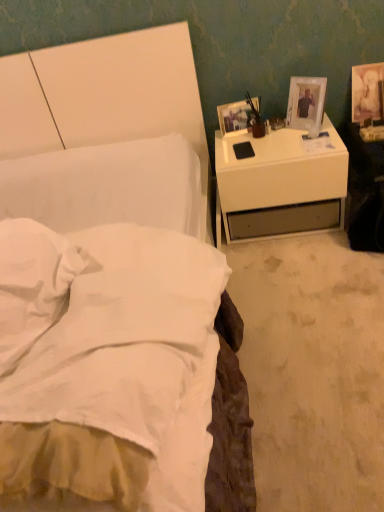
In order to click on white plastic picture frame at upper right, acting as the 2th picture frame starting from the right in this screenshot , I will do `click(306, 104)`.

What do you see at coordinates (235, 118) in the screenshot?
I see `matte white picture frame at upper right, the 1th picture frame positioned from the left` at bounding box center [235, 118].

What is the approximate width of white glossy nightstand at right?

white glossy nightstand at right is 54.21 centimeters wide.

This screenshot has height=512, width=384. What are the coordinates of `white soft bed at left` in the screenshot? It's located at (109, 348).

Locate an element on the screen. The image size is (384, 512). white plastic picture frame at upper right, the second picture frame viewed from the left is located at coordinates (306, 104).

From a real-world perspective, who is located higher, matte gold picture frame at upper right, arranged as the third picture frame when viewed from the left, or matte white picture frame at upper right, the third picture frame from the right?

matte white picture frame at upper right, the third picture frame from the right.

From the image's perspective, is matte gold picture frame at upper right, arranged as the third picture frame when viewed from the left, located above or below matte white picture frame at upper right, the third picture frame from the right?

Based on their image positions, matte gold picture frame at upper right, arranged as the third picture frame when viewed from the left, is located above matte white picture frame at upper right, the third picture frame from the right.

Is matte gold picture frame at upper right, the first picture frame when ordered from right to left, oriented towards matte white picture frame at upper right, the 1th picture frame positioned from the left?

No.

Is matte white picture frame at upper right, the third picture frame from the right, behind white plastic picture frame at upper right, acting as the 2th picture frame starting from the right?

Yes, matte white picture frame at upper right, the third picture frame from the right, is further from the viewer.

Is matte white picture frame at upper right, the 1th picture frame positioned from the left, not inside white plastic picture frame at upper right, the second picture frame viewed from the left?

matte white picture frame at upper right, the 1th picture frame positioned from the left, lies outside white plastic picture frame at upper right, the second picture frame viewed from the left,'s area.

Starting from the white plastic picture frame at upper right, acting as the 2th picture frame starting from the right, which picture frame is the 2nd one behind? Please provide its 2D coordinates.

[(235, 118)]

Is matte white picture frame at upper right, the third picture frame from the right, directly adjacent to white plastic picture frame at upper right, acting as the 2th picture frame starting from the right?

There is a gap between matte white picture frame at upper right, the third picture frame from the right, and white plastic picture frame at upper right, acting as the 2th picture frame starting from the right.

From a real-world perspective, is white glossy nightstand at right above or below white soft bed at left?

white glossy nightstand at right is situated lower than white soft bed at left in the real world.

Which object is closer to the camera, white glossy nightstand at right or white soft bed at left?

Positioned in front is white soft bed at left.

Does white glossy nightstand at right have a lesser width compared to white soft bed at left?

Yes, white glossy nightstand at right is thinner than white soft bed at left.

Between white glossy nightstand at right and white soft bed at left, which one has more height?

white soft bed at left.

Is white soft pillow at lower left completely or partially inside white soft bed at left?

Indeed, white soft pillow at lower left is located within white soft bed at left.

Considering the positions of point (174, 488) and point (55, 246), is point (174, 488) closer or farther from the camera than point (55, 246)?

Point (174, 488) is positioned closer to the camera compared to point (55, 246).

Considering the relative sizes of white soft bed at left and white soft pillow at lower left in the image provided, is white soft bed at left thinner than white soft pillow at lower left?

No.

From a real-world perspective, which object rests below the other?

From a 3D spatial view, white soft bed at left is below.

Does white soft bed at left have a smaller size compared to white glossy nightstand at right?

No, white soft bed at left is not smaller than white glossy nightstand at right.

Is white soft bed at left shorter than white glossy nightstand at right?

Incorrect, the height of white soft bed at left does not fall short of that of white glossy nightstand at right.

Would you consider matte gold picture frame at upper right, the first picture frame when ordered from right to left, to be distant from white glossy nightstand at right?

No, matte gold picture frame at upper right, the first picture frame when ordered from right to left, is not far away from white glossy nightstand at right.

Which of these two, matte gold picture frame at upper right, arranged as the third picture frame when viewed from the left, or white glossy nightstand at right, is thinner?

With smaller width is matte gold picture frame at upper right, arranged as the third picture frame when viewed from the left.

From the image's perspective, is matte gold picture frame at upper right, arranged as the third picture frame when viewed from the left, above or below white glossy nightstand at right?

From the image's perspective, matte gold picture frame at upper right, arranged as the third picture frame when viewed from the left, appears above white glossy nightstand at right.

Can you confirm if matte gold picture frame at upper right, the first picture frame when ordered from right to left, is smaller than white glossy nightstand at right?

Yes.

Based on the photo, is white soft pillow at lower left not close to matte gold picture frame at upper right, arranged as the third picture frame when viewed from the left?

Indeed, white soft pillow at lower left is not near matte gold picture frame at upper right, arranged as the third picture frame when viewed from the left.

Identify the location of pillow in front of the matte gold picture frame at upper right, the first picture frame when ordered from right to left. This screenshot has height=512, width=384. (33, 283).

Could you measure the distance between white soft pillow at lower left and matte gold picture frame at upper right, arranged as the third picture frame when viewed from the left?

white soft pillow at lower left is 1.86 meters away from matte gold picture frame at upper right, arranged as the third picture frame when viewed from the left.

Can you confirm if white soft pillow at lower left is positioned to the right of matte gold picture frame at upper right, arranged as the third picture frame when viewed from the left?

Incorrect, white soft pillow at lower left is not on the right side of matte gold picture frame at upper right, arranged as the third picture frame when viewed from the left.

Image resolution: width=384 pixels, height=512 pixels. There is a matte gold picture frame at upper right, the first picture frame when ordered from right to left. Identify the location of the 1st picture frame above it (from a real-world perspective). (235, 118).

Starting from the white plastic picture frame at upper right, the second picture frame viewed from the left, which picture frame is the 2nd one behind? Please provide its 2D coordinates.

[(235, 118)]

Considering their positions, is matte white picture frame at upper right, the 1th picture frame positioned from the left, positioned further to white plastic picture frame at upper right, the second picture frame viewed from the left, than white soft pillow at lower left?

white soft pillow at lower left.

Which object lies nearer to the anchor point white soft pillow at lower left, matte white picture frame at upper right, the 1th picture frame positioned from the left, or white soft bed at left?

Among the two, white soft bed at left is located nearer to white soft pillow at lower left.

Which object lies nearer to the anchor point matte white picture frame at upper right, the third picture frame from the right, white soft bed at left or white soft pillow at lower left?

The object closer to matte white picture frame at upper right, the third picture frame from the right, is white soft bed at left.

Which object lies nearer to the anchor point white soft bed at left, matte gold picture frame at upper right, arranged as the third picture frame when viewed from the left, or white soft pillow at lower left?

white soft pillow at lower left.

Looking at the image, which one is located further to white glossy nightstand at right, white plastic picture frame at upper right, the second picture frame viewed from the left, or white soft pillow at lower left?

white soft pillow at lower left.

When comparing their distances from white plastic picture frame at upper right, the second picture frame viewed from the left, does matte gold picture frame at upper right, the first picture frame when ordered from right to left, or white soft pillow at lower left seem closer?

matte gold picture frame at upper right, the first picture frame when ordered from right to left, lies closer to white plastic picture frame at upper right, the second picture frame viewed from the left, than the other object.

Looking at the image, which one is located closer to white plastic picture frame at upper right, the second picture frame viewed from the left, white soft bed at left or white soft pillow at lower left?

Based on the image, white soft bed at left appears to be nearer to white plastic picture frame at upper right, the second picture frame viewed from the left.

Estimate the real-world distances between objects in this image. Which object is further from white soft bed at left, white glossy nightstand at right or white plastic picture frame at upper right, the second picture frame viewed from the left?

white plastic picture frame at upper right, the second picture frame viewed from the left.

Locate an element on the screen. The height and width of the screenshot is (512, 384). picture frame positioned between white soft bed at left and matte gold picture frame at upper right, arranged as the third picture frame when viewed from the left, from near to far is located at coordinates (306, 104).

Where is `nightstand between white soft pillow at lower left and white plastic picture frame at upper right, acting as the 2th picture frame starting from the right, in the horizontal direction`? Image resolution: width=384 pixels, height=512 pixels. nightstand between white soft pillow at lower left and white plastic picture frame at upper right, acting as the 2th picture frame starting from the right, in the horizontal direction is located at coordinates (281, 183).

This screenshot has width=384, height=512. What are the coordinates of `pillow between white soft bed at left and white plastic picture frame at upper right, acting as the 2th picture frame starting from the right, from front to back` in the screenshot? It's located at (33, 283).

The image size is (384, 512). I want to click on picture frame that lies between white plastic picture frame at upper right, the second picture frame viewed from the left, and white glossy nightstand at right from top to bottom, so click(235, 118).